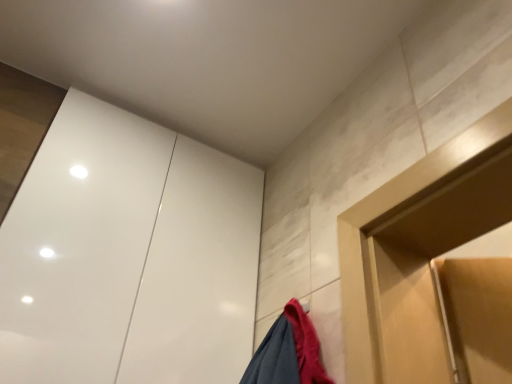
This screenshot has height=384, width=512. Identify the location of white glossy cabinet at upper left. (128, 256).

What is the approximate height of white glossy cabinet at upper left?

It is 29.01 inches.

The image size is (512, 384). Describe the element at coordinates (128, 256) in the screenshot. I see `white glossy cabinet at upper left` at that location.

At what (x,y) coordinates should I click in order to perform the action: click on white glossy cabinet at upper left. Please return your answer as a coordinate pair (x, y). Looking at the image, I should click on (128, 256).